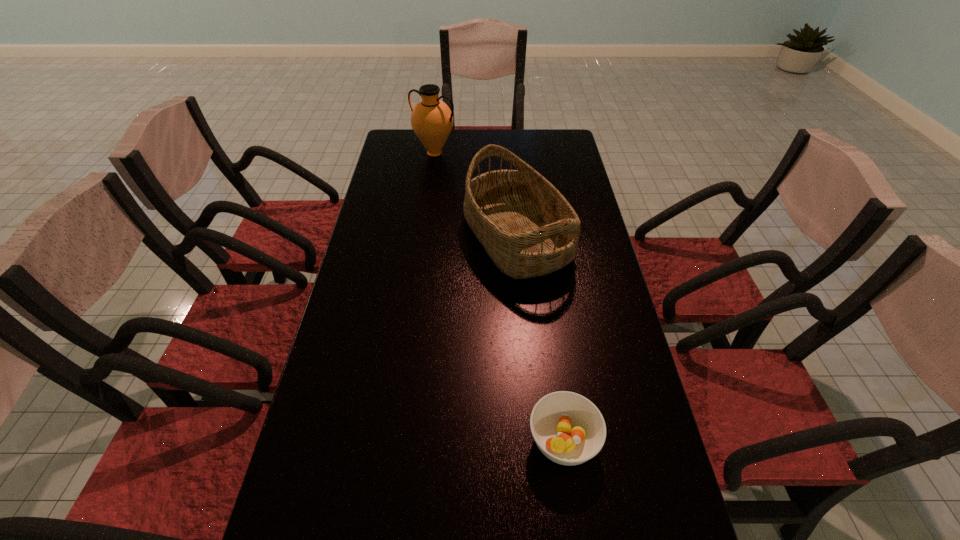
Where is `object that is at the left edge`? The width and height of the screenshot is (960, 540). object that is at the left edge is located at coordinates point(432,120).

Image resolution: width=960 pixels, height=540 pixels. I want to click on basket located at the right edge, so click(x=527, y=227).

This screenshot has width=960, height=540. Identify the location of soup bowl situated at the right edge. (569, 429).

Find the location of `object present at the far left corner`. object present at the far left corner is located at coordinates (432, 120).

Image resolution: width=960 pixels, height=540 pixels. In the image, there is a desktop. In order to click on free region at the left edge in this screenshot , I will do `click(365, 402)`.

The image size is (960, 540). I want to click on free spot at the right edge of the desktop, so click(x=616, y=462).

Find the location of a particular element. The width and height of the screenshot is (960, 540). free spot between the shortest object and the tallest object is located at coordinates (499, 297).

I want to click on free area in between the farthest object and the nearest object, so click(x=499, y=297).

The height and width of the screenshot is (540, 960). I want to click on vacant area that lies between the leftmost object and the shortest object, so click(499, 297).

The width and height of the screenshot is (960, 540). What are the coordinates of `empty location between the nearest object and the pitcher` in the screenshot? It's located at (499, 297).